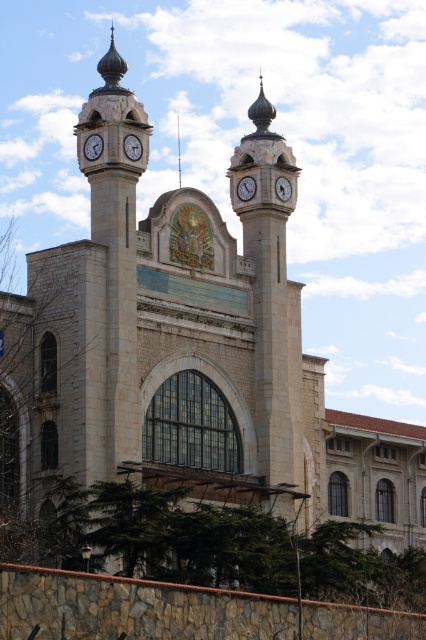
You are standing in front of the grand building and notice two clocks. The matte white clock at left and the white glossy clock at center. Which clock is positioned more to the left side of the building?

The matte white clock at left is positioned more to the left side of the building compared to the white glossy clock at center.

You are an architect reviewing the building plans and notice the matte white clock at left and the smooth silver spire at center. Which object is located to the left of the other?

The matte white clock at left is positioned on the left side of smooth silver spire at center, so the matte white clock at left is to the left of the smooth silver spire at center.